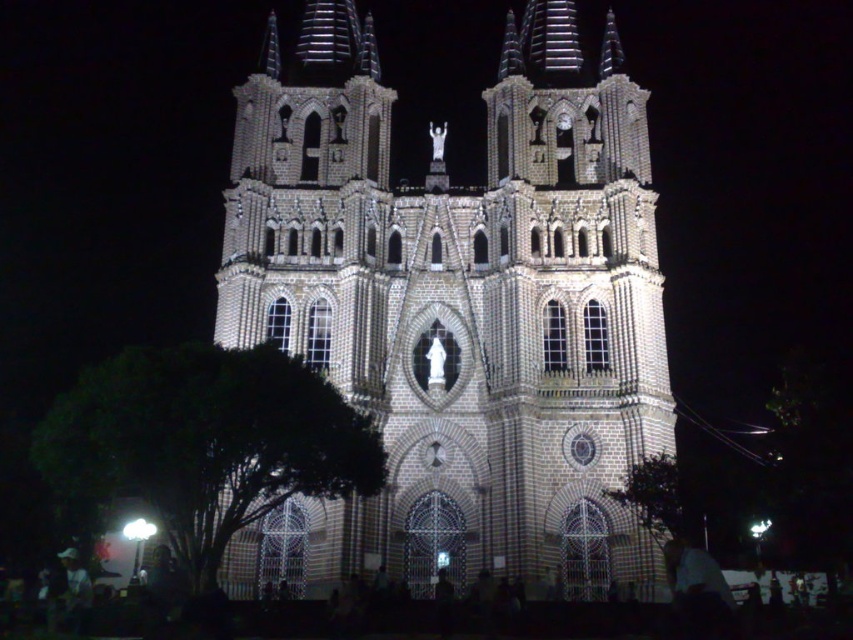
Question: Is brown textured stone church at center closer to camera compared to green leafy tree at lower right?

Choices:
 (A) yes
 (B) no

Answer: (A)

Question: From the image, what is the correct spatial relationship of brown textured stone church at center in relation to green leafy tree at lower right?

Choices:
 (A) below
 (B) above

Answer: (B)

Question: Which object appears closest to the camera in this image?

Choices:
 (A) green leafy tree at lower left
 (B) brown textured stone church at center

Answer: (A)

Question: Estimate the real-world distances between objects in this image. Which object is farther from the green leafy tree at lower left?

Choices:
 (A) brown textured stone church at center
 (B) green leafy tree at lower right

Answer: (B)

Question: Is brown textured stone church at center below green leafy tree at lower left?

Choices:
 (A) yes
 (B) no

Answer: (B)

Question: Which object appears closest to the camera in this image?

Choices:
 (A) green leafy tree at lower left
 (B) green leafy tree at lower right

Answer: (A)